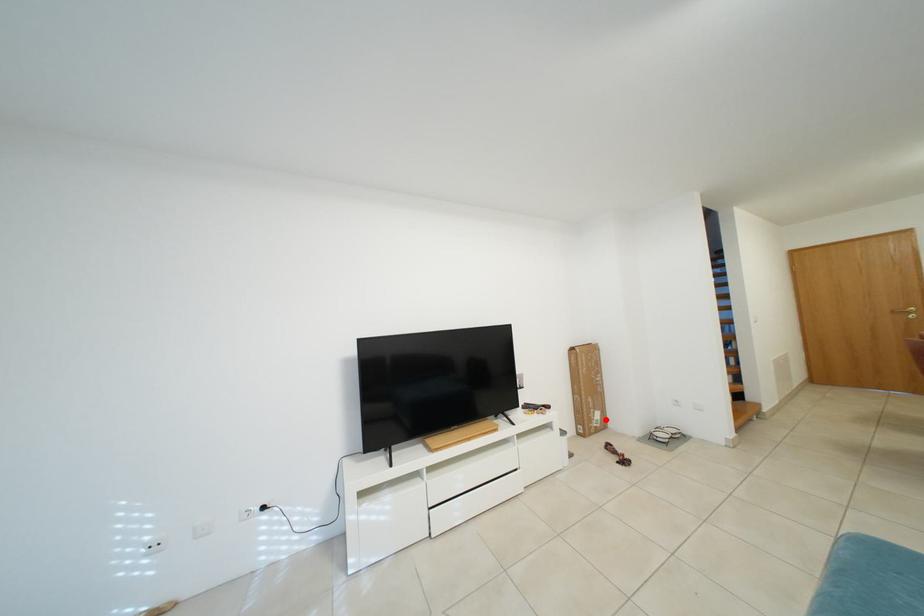
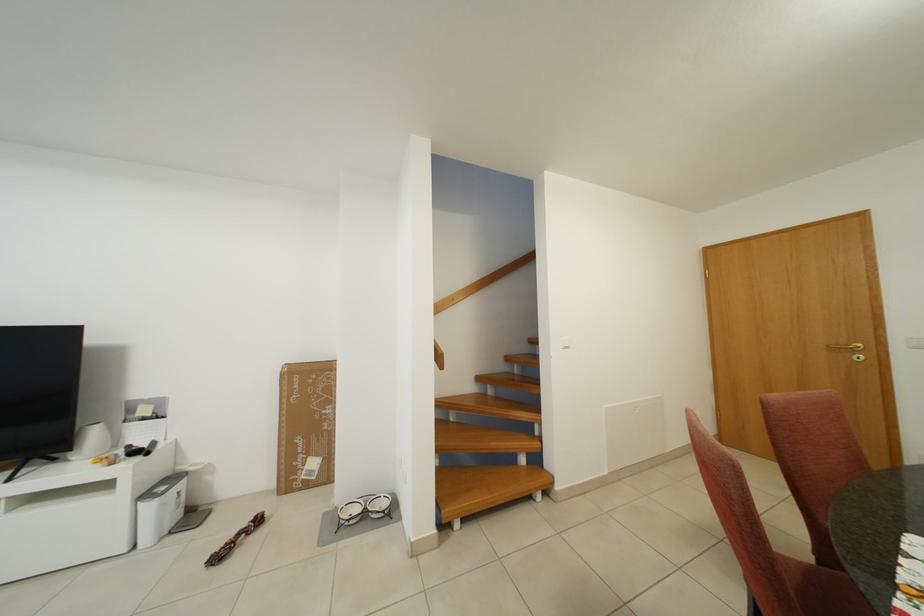
Question: I am providing you with two images of the same scene from different viewpoints. A red point is shown in image1. For the corresponding object point in image2, is it positioned nearer or farther from the camera?

Choices:
 (A) Nearer
 (B) Farther

Answer: (A)